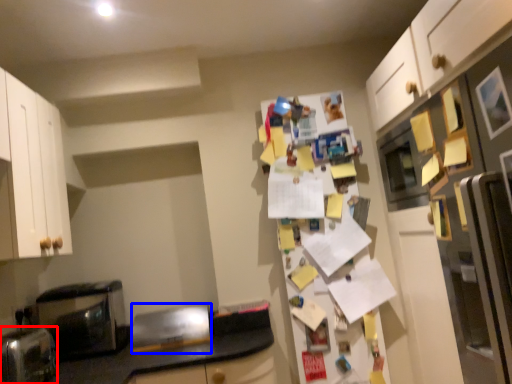
Question: Which of the following is the closest to the observer, appliance (highlighted by a red box) or appliance (highlighted by a blue box)?

Choices:
 (A) appliance
 (B) appliance

Answer: (A)